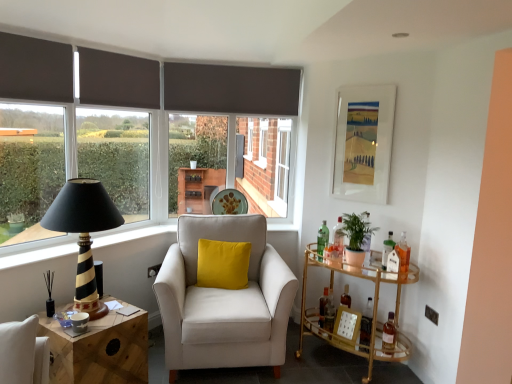
The height and width of the screenshot is (384, 512). I want to click on empty space that is ontop of wooden side table at lower left, which is counted as the second table, starting from the right (from a real-world perspective), so click(92, 314).